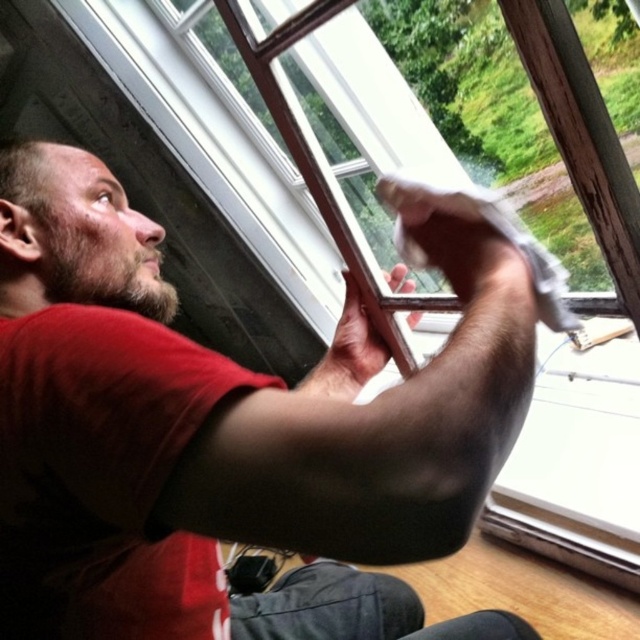
Question: Which of the following is the farthest from the observer?

Choices:
 (A) brownwoollybeard at left
 (B) matte red t-shirt at center

Answer: (A)

Question: Is matte red t-shirt at center bigger than brownwoollybeard at left?

Choices:
 (A) yes
 (B) no

Answer: (A)

Question: Is matte red t-shirt at center closer to camera compared to brownwoollybeard at left?

Choices:
 (A) yes
 (B) no

Answer: (A)

Question: Which point is closer to the camera?

Choices:
 (A) (109, 289)
 (B) (26, 420)

Answer: (B)

Question: Does matte red t-shirt at center have a greater width compared to brownwoollybeard at left?

Choices:
 (A) yes
 (B) no

Answer: (A)

Question: Which object appears farthest from the camera in this image?

Choices:
 (A) brownwoollybeard at left
 (B) matte red t-shirt at center

Answer: (A)